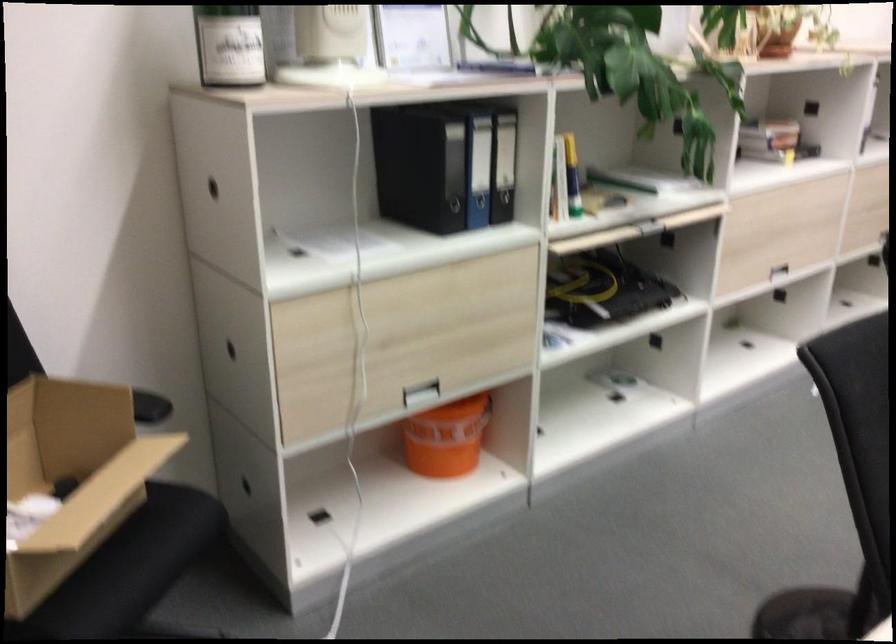
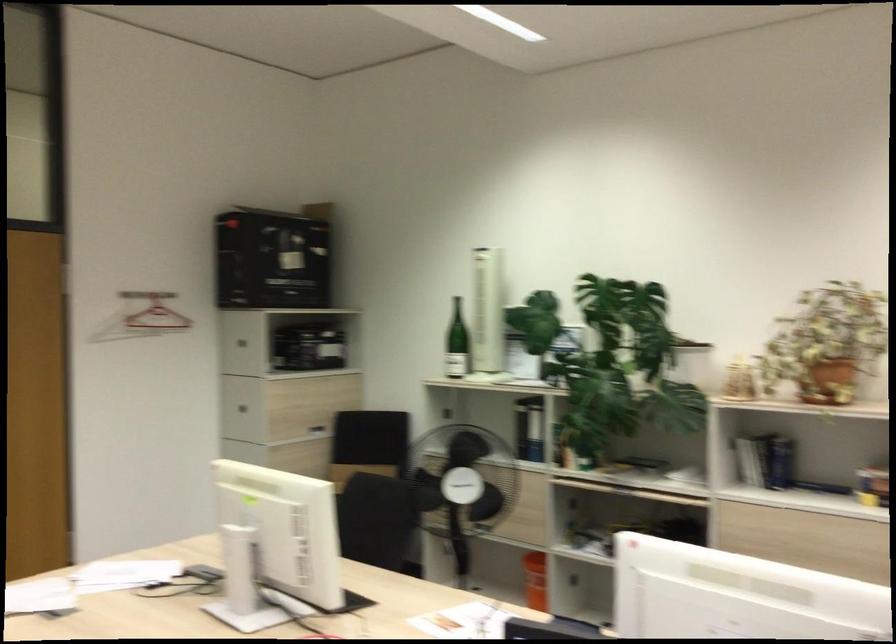
Question: I am providing you with two images of the same scene from different viewpoints. Which of the following objects are not visible in image2?

Choices:
 (A) black binder
 (B) chair sitting surface
 (C) orange bucket
 (D) brown leather roller

Answer: (A)